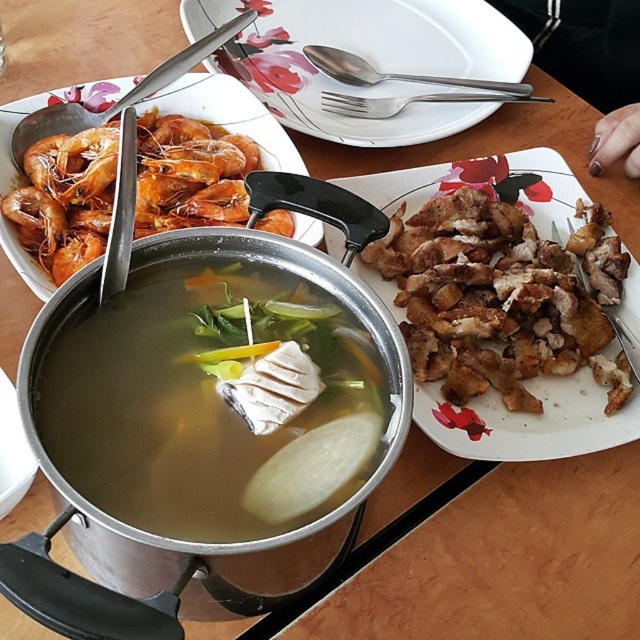
Question: Does orange matte shrimp at left have a smaller size compared to satin silver spoon at upper center?

Choices:
 (A) no
 (B) yes

Answer: (A)

Question: Does brown translucent broth at center appear on the right side of orange matte shrimp at left?

Choices:
 (A) yes
 (B) no

Answer: (A)

Question: Which object is the farthest from the brown crispy chicken at right?

Choices:
 (A) white glossy plate at upper center
 (B) brown translucent broth at center
 (C) satin silver spoon at upper center
 (D) orange matte shrimp at left

Answer: (C)

Question: Which object appears closest to the camera in this image?

Choices:
 (A) brown crispy chicken at right
 (B) satin silver spoon at upper center
 (C) white glossy plate at upper center

Answer: (A)

Question: Which of these objects is positioned farthest from the white glossy plate at upper center?

Choices:
 (A) orange matte shrimp at left
 (B) brown crispy chicken at right
 (C) brown translucent broth at center

Answer: (C)

Question: From the image, what is the correct spatial relationship of brown crispy chicken at right in relation to orange matte shrimp at left?

Choices:
 (A) right
 (B) left

Answer: (A)